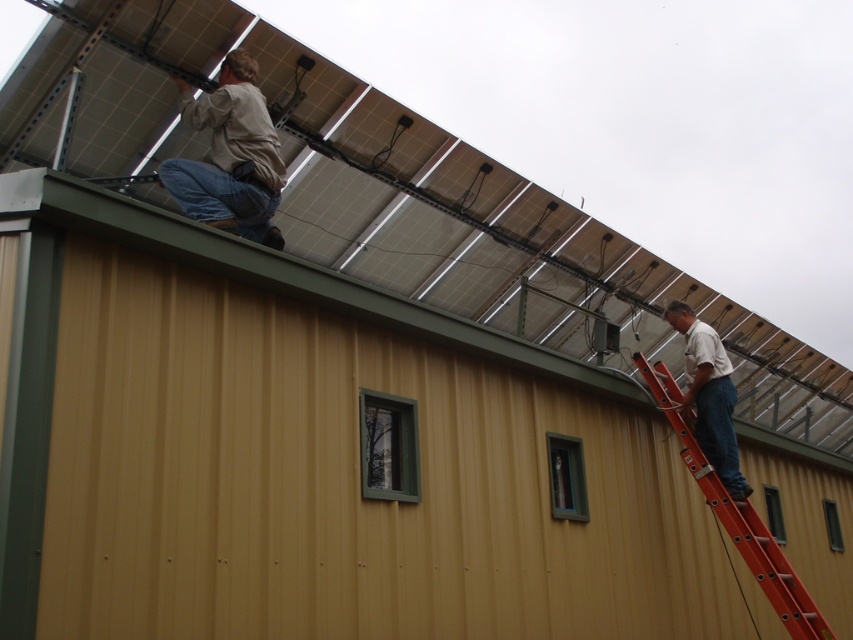
You are a maintenance worker standing at the base of the ladder. You need to reach the point marked at coordinates point (260, 186) on the roof to inspect a solar panel. The ladder you are using is 4.5 meters tall. Can you safely reach that point with the ladder you have?

The distance between you and point (260, 186) is 5.11 meters, which is greater than the ladder height of 4.5 meters. Therefore, you cannot safely reach the point with the current ladder.

You are a contractor assessing the safety of the roof setup. You notice the orange fiberglass ladder at upper right and the white matte shirt at right. Which object is positioned closer to you as you look at the scene?

The orange fiberglass ladder at upper right is closer to the viewer than the white matte shirt at right.

You are a technician on the roof and need to move from the point at coordinate (199, 100) to the point at coordinate (724, 522). Given the roof has a slope, which direction should you move to reach the destination?

Since point (199, 100) is in front of point (724, 522), you should move backward along the slope to reach the destination.